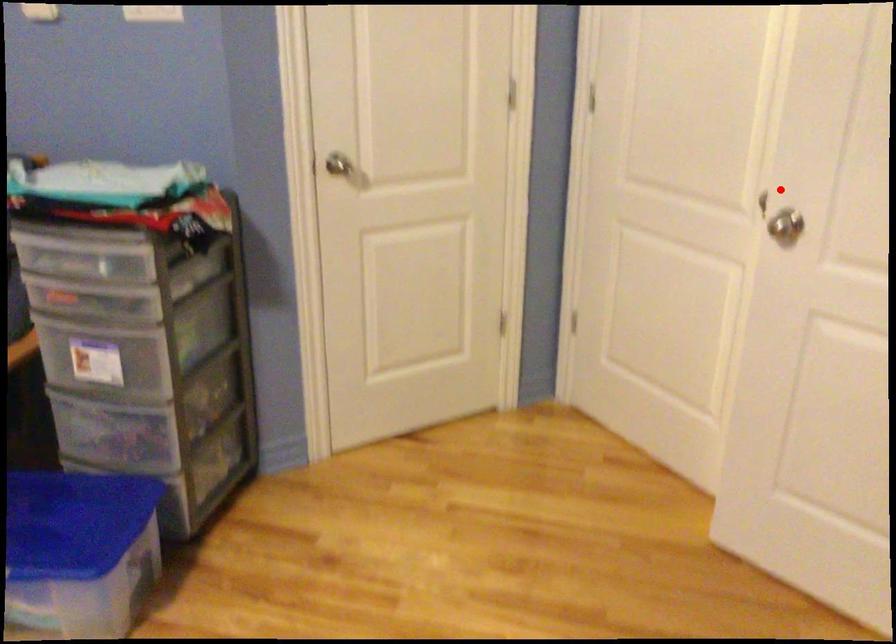
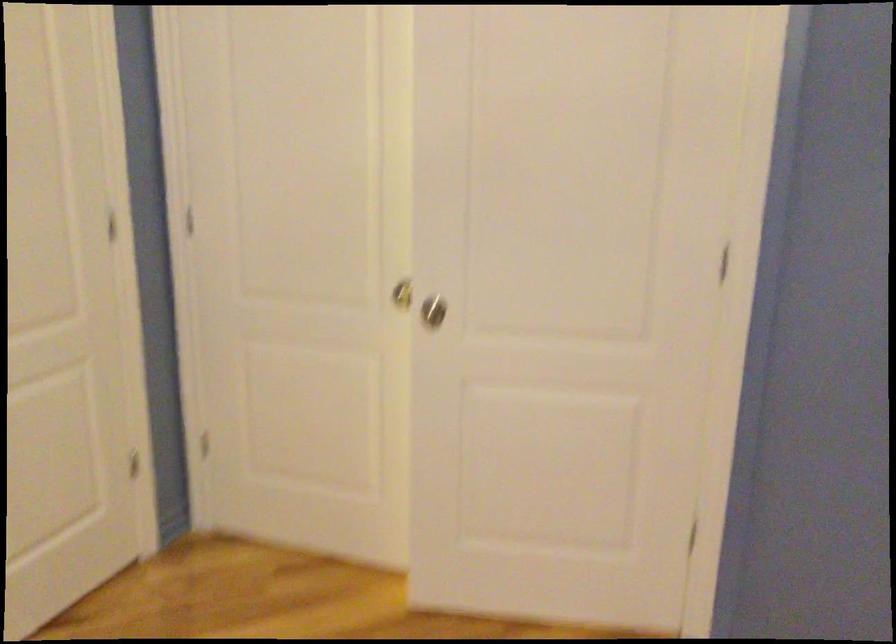
In the second image, find the point that corresponds to the highlighted location in the first image.

(401, 292)